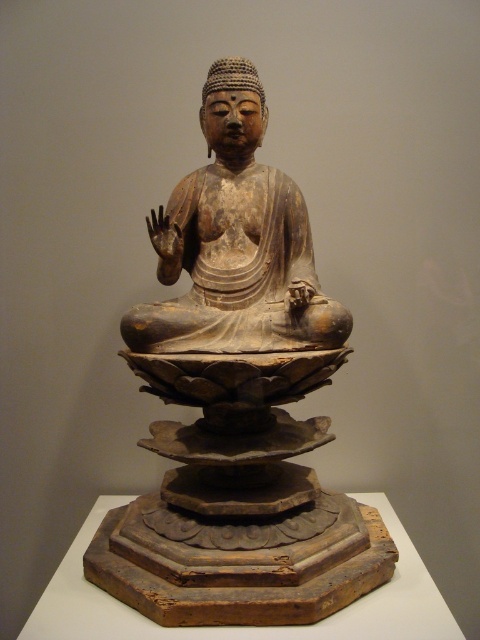
Which is in front, point (159, 252) or point (276, 193)?

Point (159, 252) is more forward.

This screenshot has height=640, width=480. I want to click on matte brown wood statue at center, so click(238, 401).